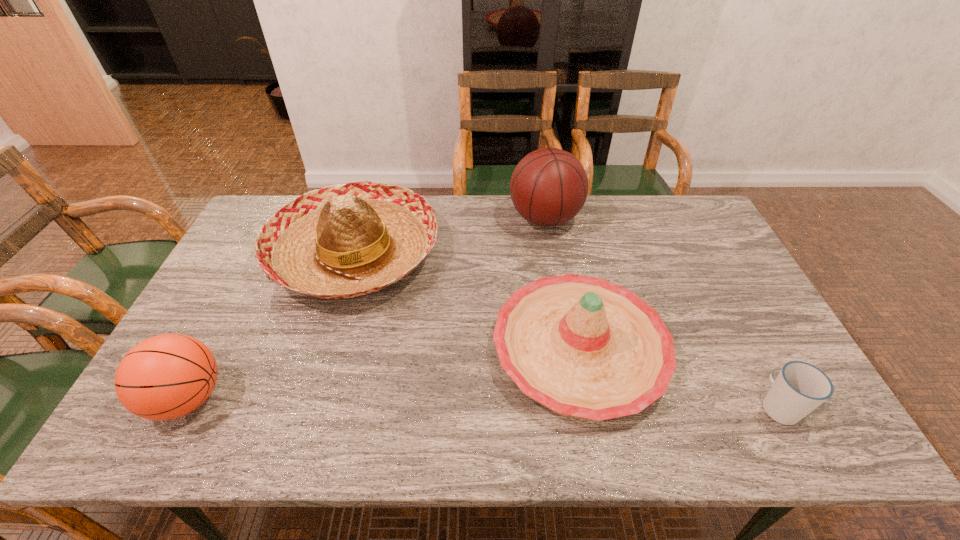
Image resolution: width=960 pixels, height=540 pixels. I want to click on the tallest object, so click(549, 186).

Locate an element on the screen. This screenshot has height=540, width=960. the farther basketball is located at coordinates (549, 186).

At what (x,y) coordinates should I click in order to perform the action: click on the left sombrero. Please return your answer as a coordinate pair (x, y). This screenshot has width=960, height=540. Looking at the image, I should click on (342, 241).

The width and height of the screenshot is (960, 540). I want to click on the right sombrero, so click(584, 347).

Where is `the left basketball`? the left basketball is located at coordinates (167, 376).

The width and height of the screenshot is (960, 540). Identify the location of the nearer basketball. (167, 376).

Locate an element on the screen. This screenshot has height=540, width=960. the shortest object is located at coordinates (800, 387).

Where is `cup`? This screenshot has height=540, width=960. cup is located at coordinates click(x=800, y=387).

Locate an element on the screen. free point located on the left of the farther basketball is located at coordinates (399, 218).

I want to click on vacant space located on the right of the left sombrero, so click(x=545, y=253).